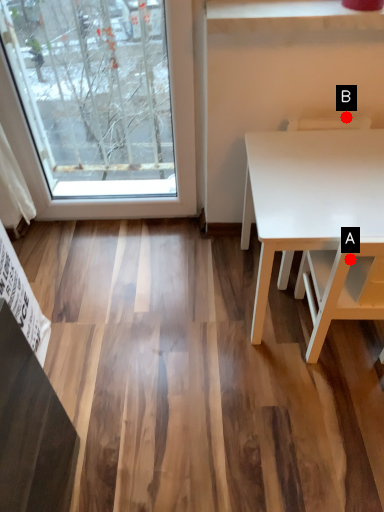
Question: Two points are circled on the image, labeled by A and B beside each circle. Which point is further to the camera?

Choices:
 (A) A is further
 (B) B is further

Answer: (B)